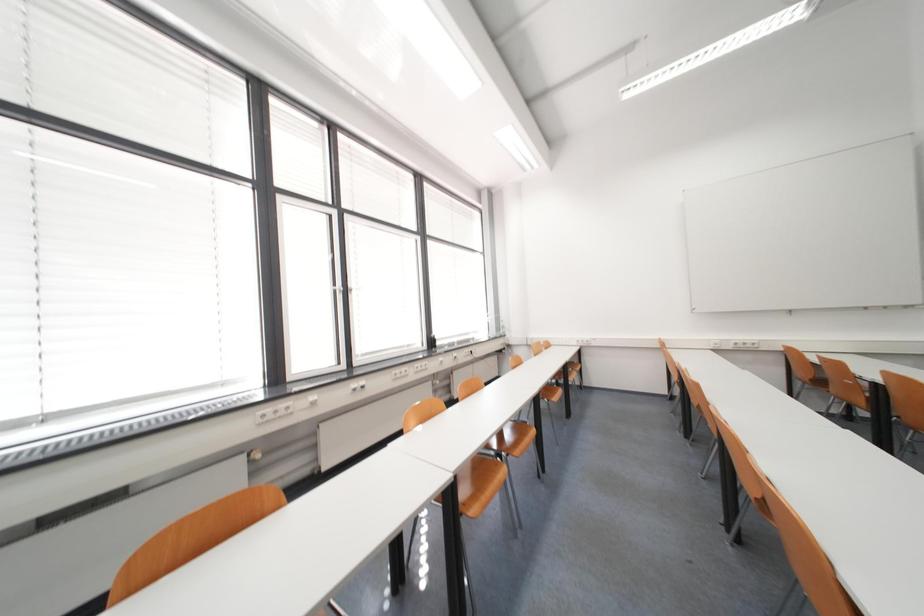
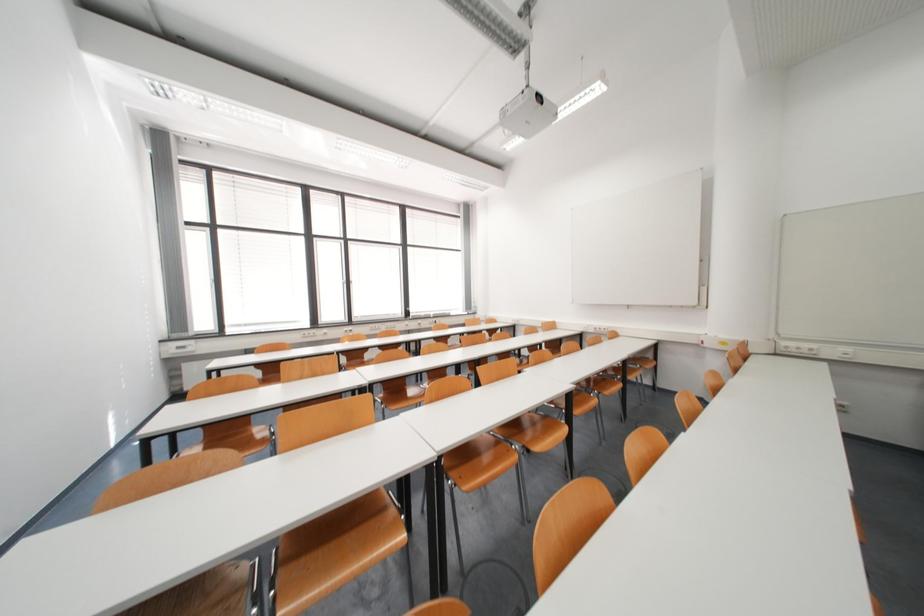
Which direction would the cameraman need to move to produce the second image?

The movement direction of the cameraman is right, backward.